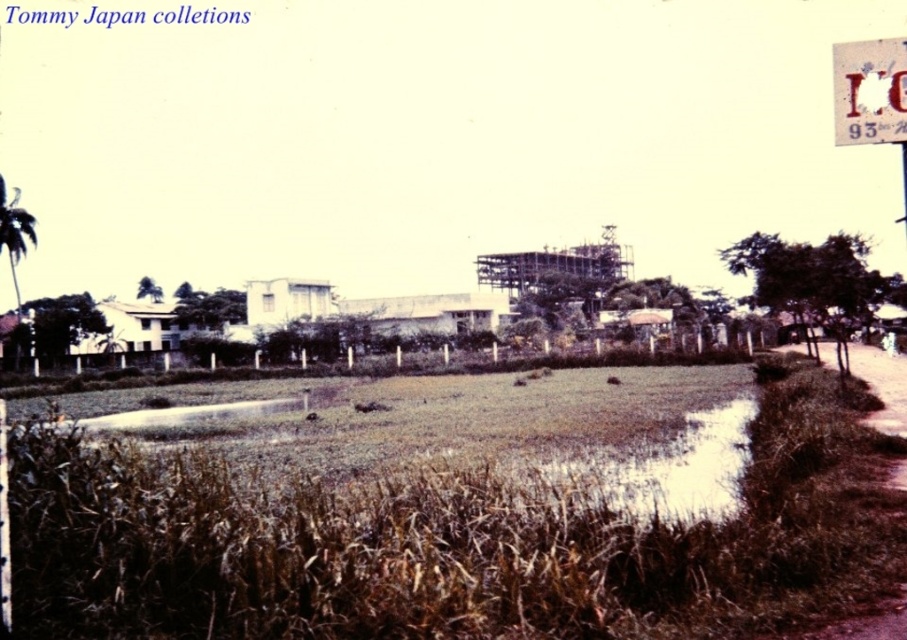
Is white paper at upper right positioned behind brown dirt track at lower right?

Yes.

Who is positioned more to the left, white paper at upper right or brown dirt track at lower right?

Positioned to the left is white paper at upper right.

Who is more distant from viewer, [898,92] or [883,413]?

The point [883,413] is more distant.

Locate an element on the screen. This screenshot has height=640, width=907. white paper at upper right is located at coordinates 869,92.